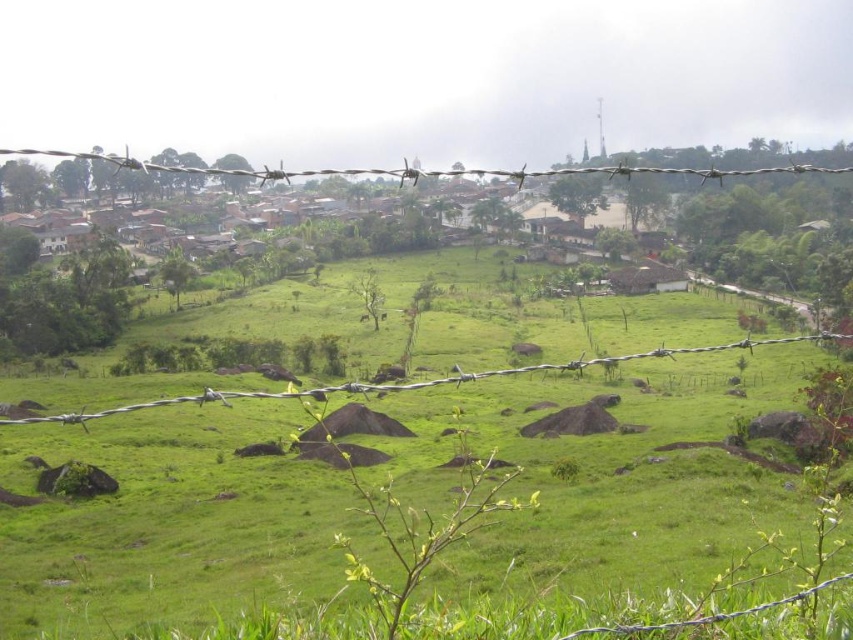
Question: Can you confirm if green grassy field at center is positioned to the right of silver barbed wire at upper center?

Choices:
 (A) no
 (B) yes

Answer: (A)

Question: Among these objects, which one is nearest to the camera?

Choices:
 (A) silver barbed wire at upper center
 (B) green grassy field at center

Answer: (B)

Question: Does green grassy field at center have a smaller size compared to silver barbed wire at upper center?

Choices:
 (A) yes
 (B) no

Answer: (A)

Question: Is green grassy field at center below silver barbed wire at upper center?

Choices:
 (A) yes
 (B) no

Answer: (A)

Question: Which point appears farthest from the camera in this image?

Choices:
 (A) (714, 172)
 (B) (352, 435)

Answer: (B)